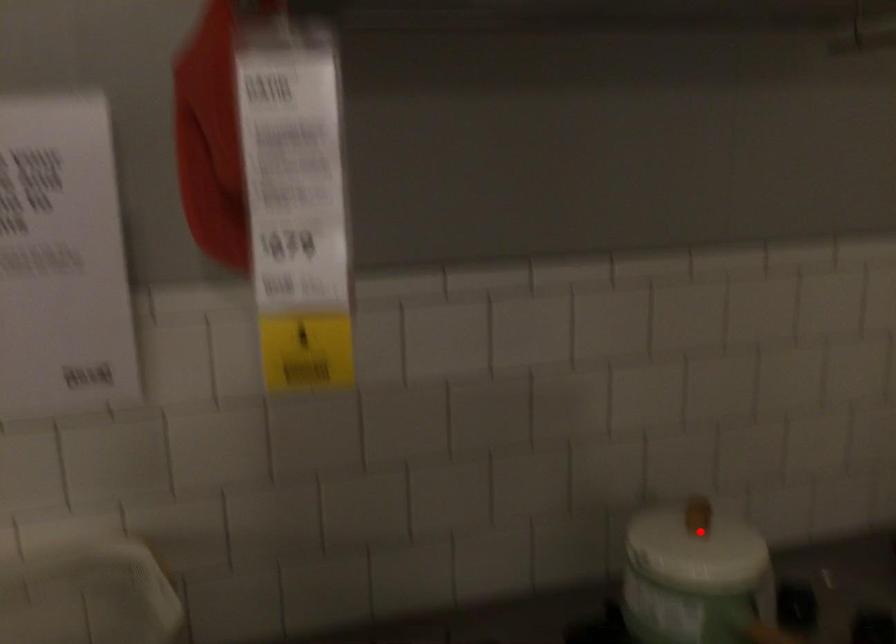
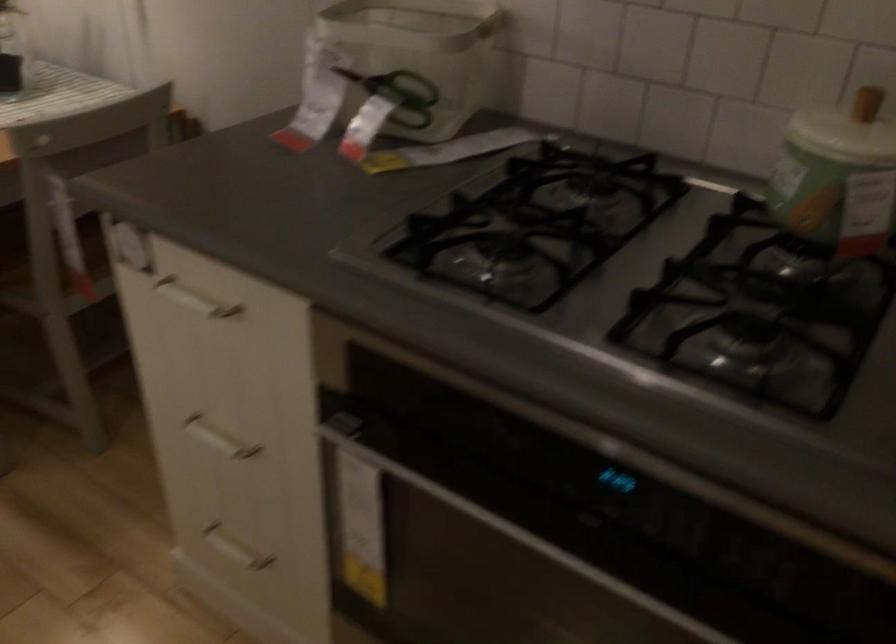
Locate, in the second image, the point that corresponds to the highlighted location in the first image.

(866, 102)